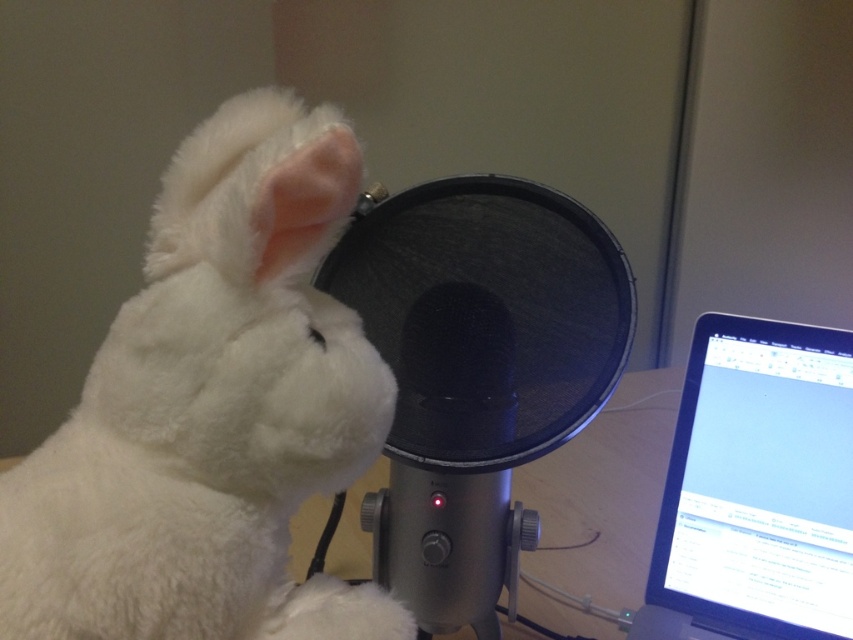
You are setting up for a podcast recording. You have a metallic black microphone at center and a silver metallic laptop at right. Which device should you adjust first to ensure proper audio recording, and why?

You should adjust the metallic black microphone at center first because it has a larger size compared to the silver metallic laptop at right, making it the primary audio input device for recording.

You are a photographer setting up a shot of the plush white rabbit toy and the laptop. You need to position your camera so that both the rabbit and the laptop are in focus. The rabbit is at point (283,266) and the laptop is at point (523,284). Which object is closer to the camera, and therefore requires adjusting the focus to ensure both are clear?

Point (283,266) is closer to the viewer than point (523,284). Therefore, the plush white rabbit toy at point (283,266) is closer to the camera. To ensure both are in focus, adjust the focus so that the rabbit is sharp, then check the laptop at point (523,284) to confirm clarity.

You are setting up for a podcast recording session and need to adjust the microphone and laptop positions. If you want to move the metallic black microphone at center closer to the silver metallic laptop at right, which direction should you move it?

The metallic black microphone at center is currently closer to the viewer than the silver metallic laptop at right. To move it closer to the laptop, you should move it backward, away from the viewer, towards the position of the laptop.